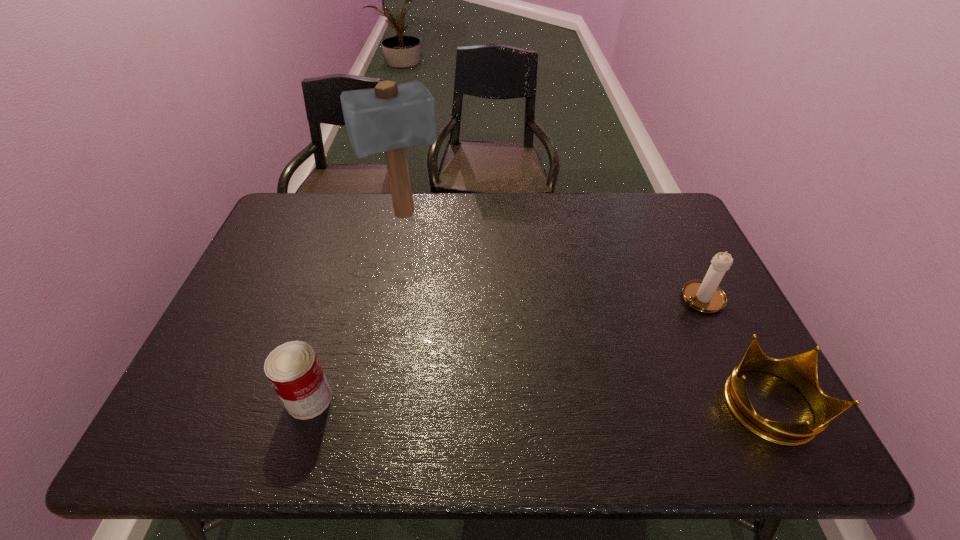
Where is `free space located on the striking surface of the tallest object`? free space located on the striking surface of the tallest object is located at coordinates (420, 245).

You are a GUI agent. You are given a task and a screenshot of the screen. Output one action in this format:
    pyautogui.click(x=<x>, y=<y>)
    Task: Click on the vacant space located 0.350m on the striking surface of the tallest object
    
    Given the screenshot: What is the action you would take?
    pyautogui.click(x=450, y=310)

Identify the location of blank space located on the handle side of the third nearest object. (668, 318).

Locate an element on the screen. This screenshot has width=960, height=540. vacant region located 0.240m on the handle side of the third nearest object is located at coordinates (623, 347).

Locate an element on the screen. This screenshot has height=540, width=960. free space located 0.060m on the handle side of the third nearest object is located at coordinates (671, 316).

Locate an element on the screen. The height and width of the screenshot is (540, 960). object present at the far edge is located at coordinates (388, 118).

Find the location of a particular element. The height and width of the screenshot is (540, 960). can present at the near edge is located at coordinates (293, 369).

Locate an element on the screen. crown located in the near edge section of the desktop is located at coordinates (800, 370).

Locate an element on the screen. crown situated at the right edge is located at coordinates (800, 370).

Find the location of `candle holder at the right edge`. candle holder at the right edge is located at coordinates (704, 295).